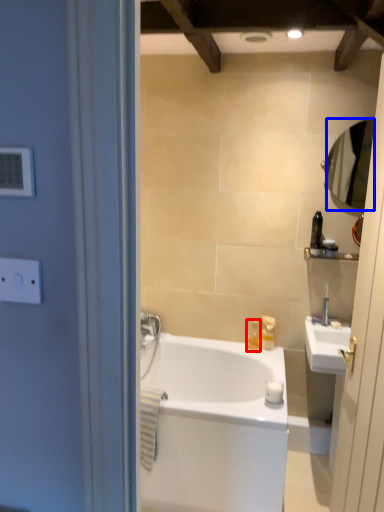
Question: Which point is closer to the camera, toiletry (highlighted by a red box) or mirror (highlighted by a blue box)?

Choices:
 (A) toiletry
 (B) mirror

Answer: (B)